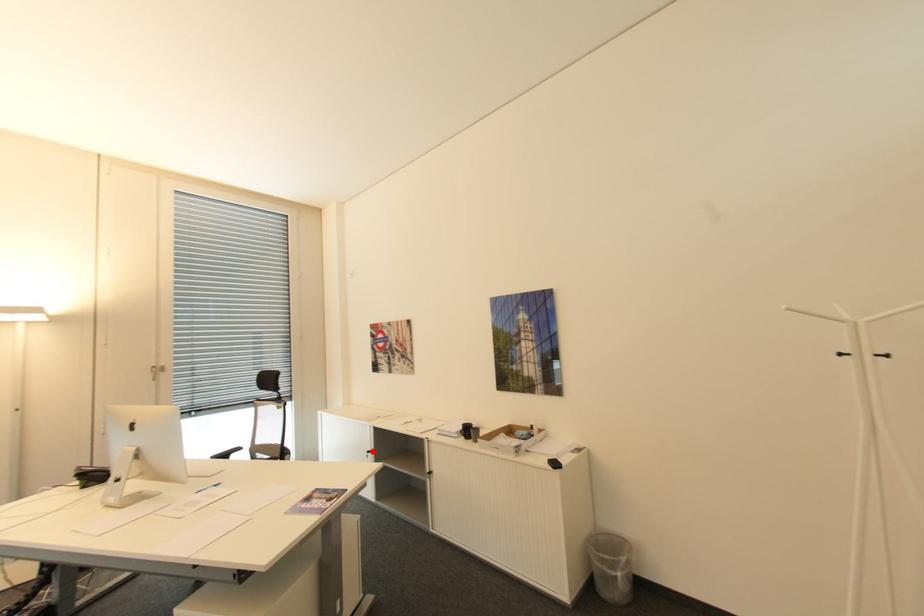
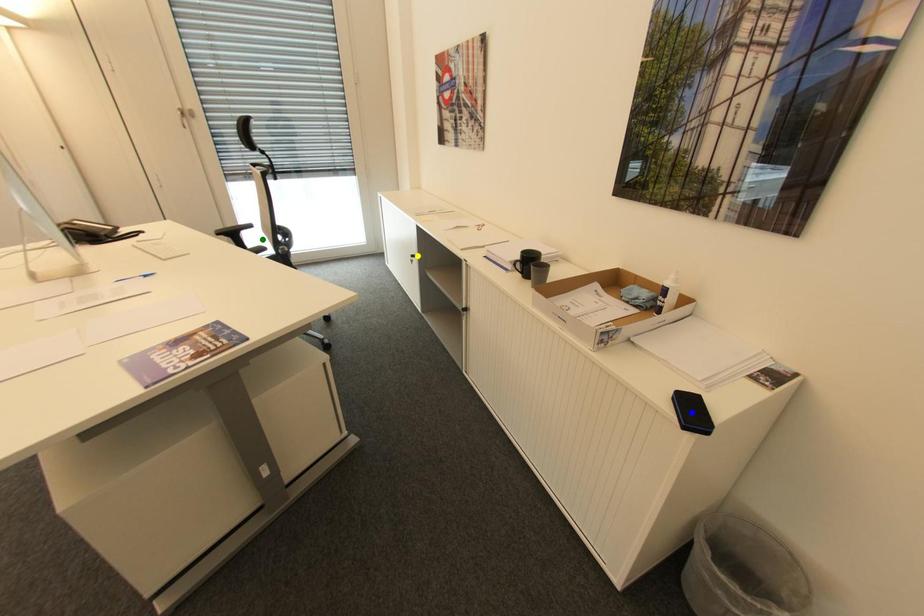
Question: I am providing you with two images of the same scene from different viewpoints. A red point is marked on the first image. You are given multiple points on the second image. Which point in image 2 represents the same 3d spot as the red point in image 1?

Choices:
 (A) yellow point
 (B) blue point
 (C) green point

Answer: (A)